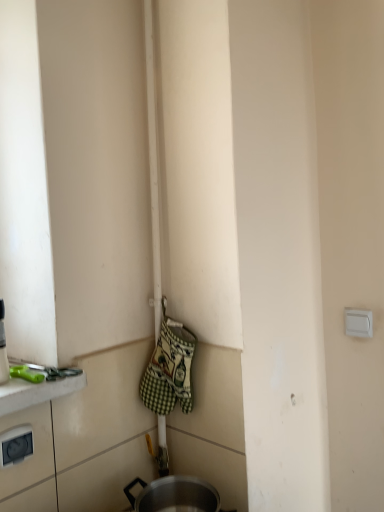
Question: From a real-world perspective, is white plastic electric outlet at lower left, positioned as the 1th electric outlet in front-to-back order, physically located above or below white plastic electric outlet at upper right, placed as the 1th electric outlet when sorted from right to left?

Choices:
 (A) below
 (B) above

Answer: (A)

Question: Considering the positions of white plastic electric outlet at lower left, which is the first electric outlet in bottom-to-top order, and white plastic electric outlet at upper right, the 2th electric outlet viewed from the left, in the image, is white plastic electric outlet at lower left, which is the first electric outlet in bottom-to-top order, taller or shorter than white plastic electric outlet at upper right, the 2th electric outlet viewed from the left,?

Choices:
 (A) tall
 (B) short

Answer: (A)

Question: Which is farther from the white plastic electric outlet at lower left, which is the second electric outlet from back to front?

Choices:
 (A) white plastic electric outlet at upper right, which is the 2th electric outlet in bottom-to-top order
 (B) green checkered fabric oven mitts at center
 (C) green plastic scissors at lower left

Answer: (A)

Question: Which object is the closest to the white plastic electric outlet at upper right, marked as the second electric outlet in a front-to-back arrangement?

Choices:
 (A) green checkered fabric oven mitts at center
 (B) white plastic electric outlet at lower left, positioned as the 1th electric outlet in front-to-back order
 (C) green plastic scissors at lower left

Answer: (A)